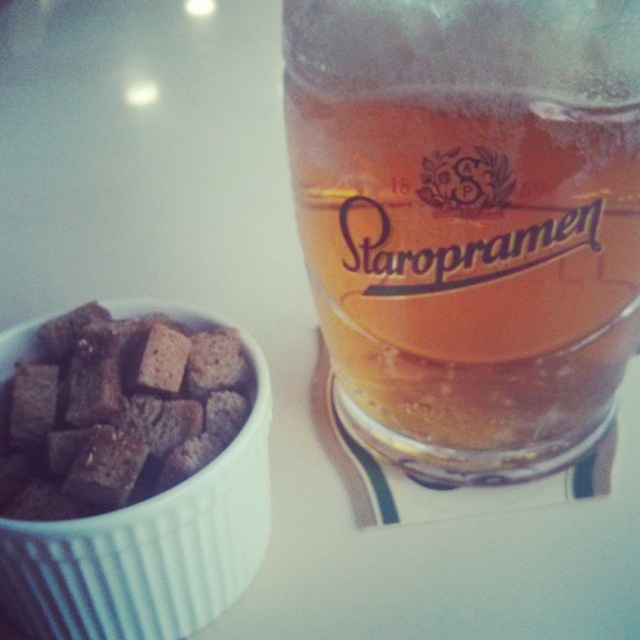
You are a bartender preparing a drink. You need to place the translucent glass beer at upper right and the brown crumbly bread at left on a shelf. The shelf has a height limit of 15 cm. Can both items fit vertically on the shelf without exceeding the height limit?

The translucent glass beer at upper right has a greater height compared to brown crumbly bread at left. Since the shelf has a height limit of 15 cm, both items can fit vertically as long as the tallest item, the translucent glass beer at upper right, is under 15 cm. However, the exact height of the beer glass isn

What are the coordinates of the translucent glass beer at upper right?

The coordinates of the translucent glass beer at upper right are at point (x=468, y=221).